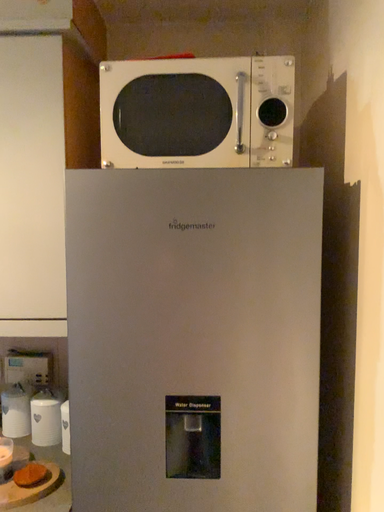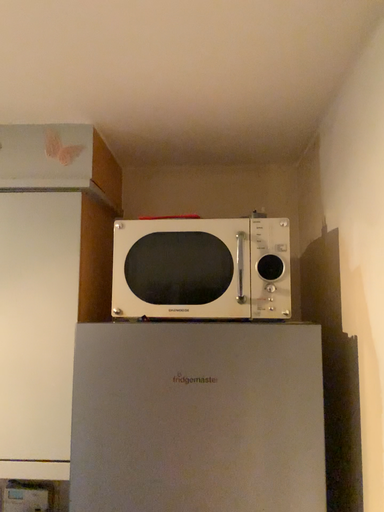
Question: How did the camera likely rotate when shooting the video?

Choices:
 (A) rotated downward
 (B) rotated upward

Answer: (B)